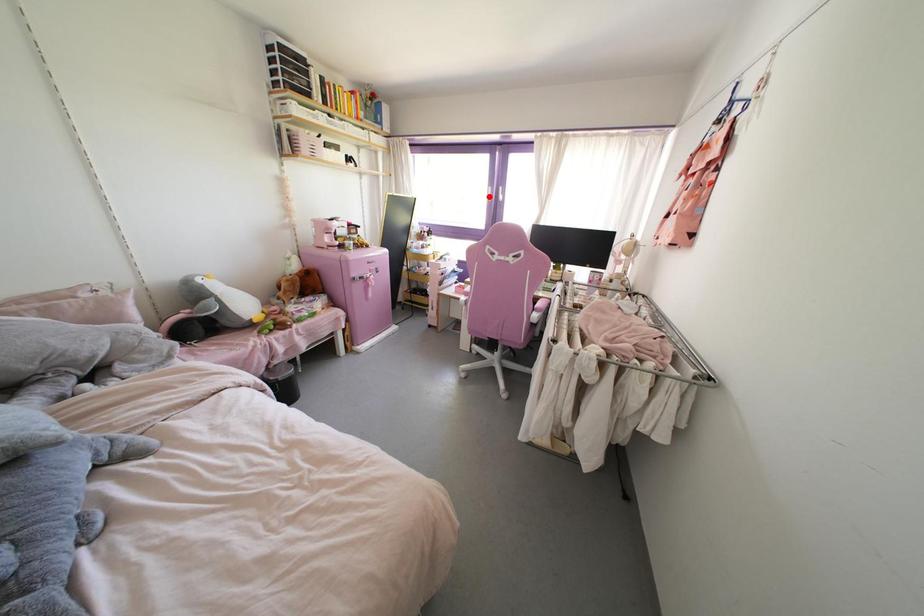
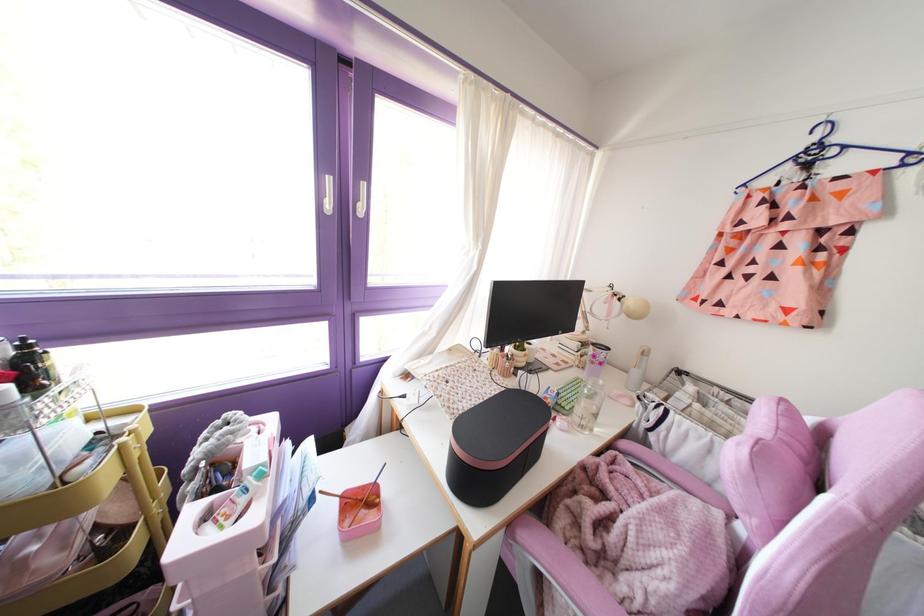
Question: I am providing you with two images of the same scene from different viewpoints. A red point is marked on the first image. Is the red point's position out of view in image 2?

Choices:
 (A) Yes
 (B) No

Answer: (B)